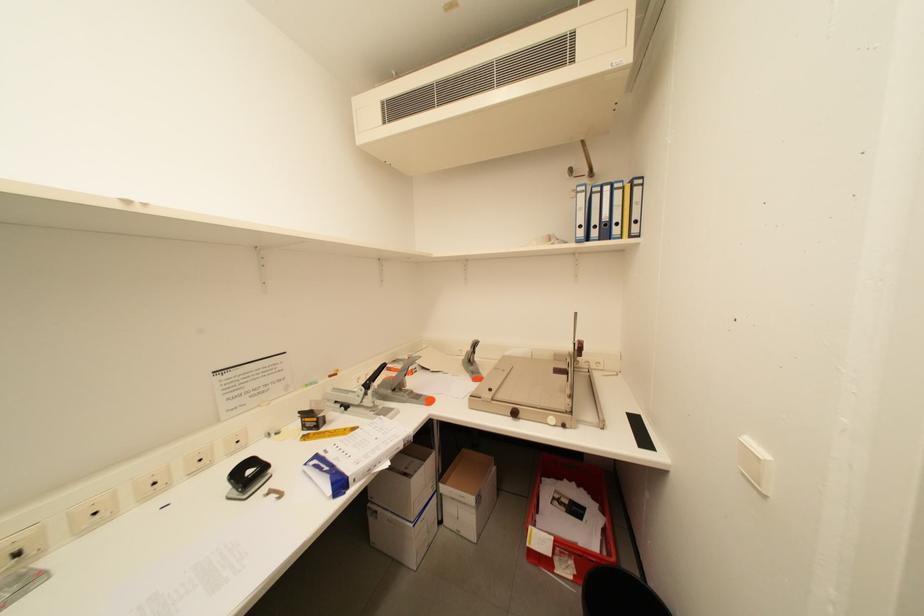
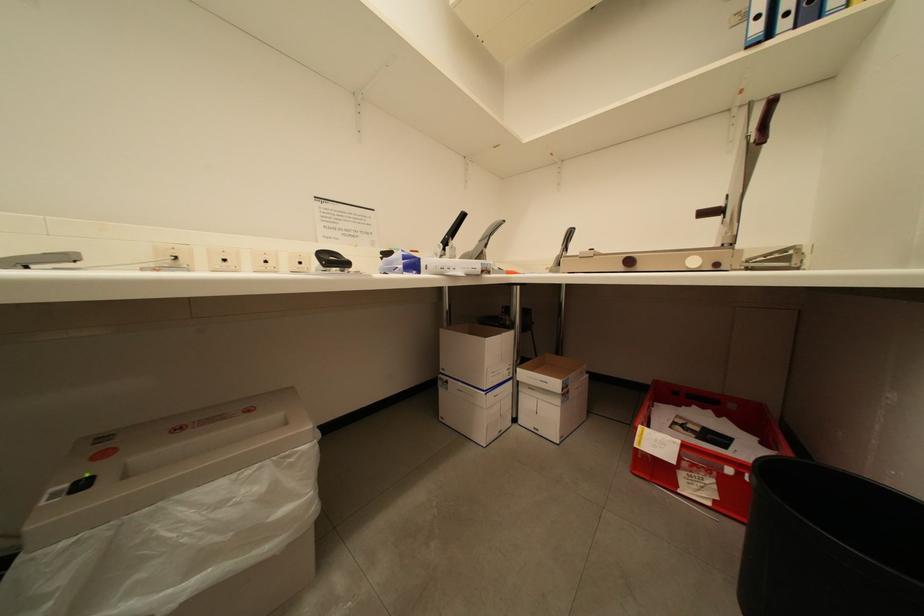
Question: The camera is either moving clockwise (left) or counter-clockwise (right) around the object. The first image is from the beginning of the video and the second image is from the end. Is the camera moving left or right when shooting the video?

Choices:
 (A) Left
 (B) Right

Answer: (B)